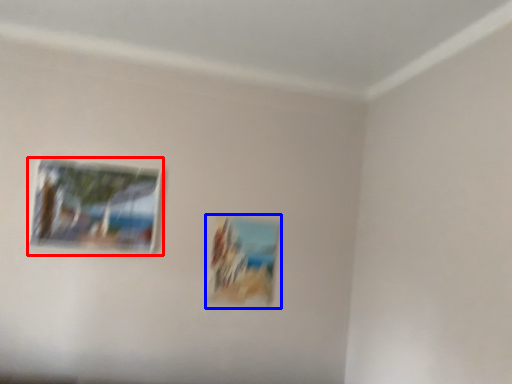
Question: Which of the following is the closest to the observer, picture frame (highlighted by a red box) or picture frame (highlighted by a blue box)?

Choices:
 (A) picture frame
 (B) picture frame

Answer: (A)